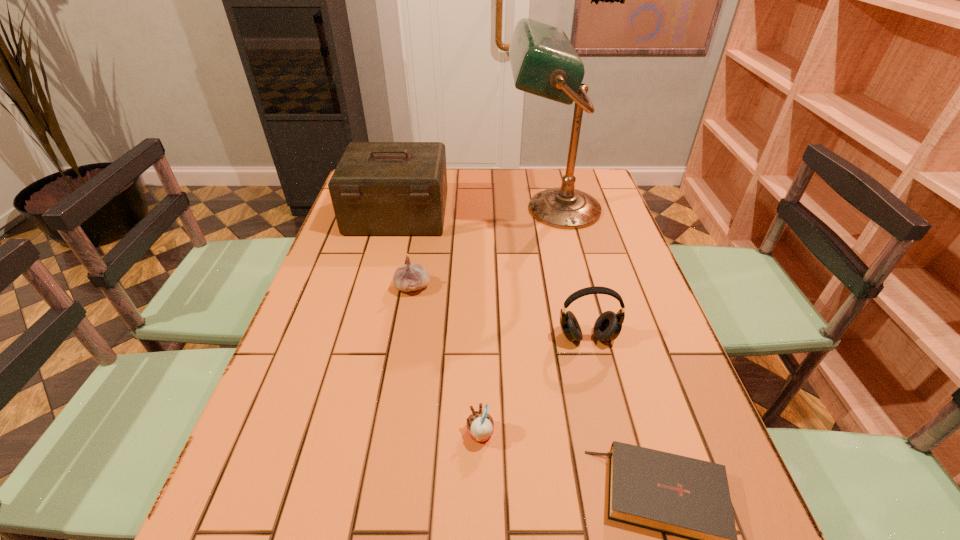
Identify the location of free location located above the green lampshade of the tallest object. (467, 209).

Locate an element on the screen. This screenshot has height=540, width=960. free spot located 0.050m on the front of the fifth shortest object is located at coordinates (389, 250).

This screenshot has width=960, height=540. Find the location of `blank space located on the ear cups of the third tallest object`. blank space located on the ear cups of the third tallest object is located at coordinates (612, 437).

I want to click on free space located on the front of the third shortest object, so pos(399,366).

You are a GUI agent. You are given a task and a screenshot of the screen. Output one action in this format:
    pyautogui.click(x=<x>, y=<y>)
    Task: Click on the vacant space positioned on the front-facing side of the third object from left to right
    The width and height of the screenshot is (960, 540).
    Given the screenshot: What is the action you would take?
    pyautogui.click(x=328, y=434)

Where is `vacant space situated 0.290m on the front-facing side of the third object from left to right`? vacant space situated 0.290m on the front-facing side of the third object from left to right is located at coordinates (318, 434).

You are a GUI agent. You are given a task and a screenshot of the screen. Output one action in this format:
    pyautogui.click(x=<x>, y=<y>)
    Task: Click on the vacant area situated on the front-facing side of the third object from left to right
    This screenshot has height=540, width=960.
    Given the screenshot: What is the action you would take?
    pyautogui.click(x=405, y=434)

Image resolution: width=960 pixels, height=540 pixels. I want to click on table lamp located in the far edge section of the desktop, so click(544, 62).

You are a GUI agent. You are given a task and a screenshot of the screen. Output one action in this format:
    pyautogui.click(x=<x>, y=<y>)
    Task: Click on the first-aid kit located in the far edge section of the desktop
    Image resolution: width=960 pixels, height=540 pixels.
    Given the screenshot: What is the action you would take?
    pyautogui.click(x=378, y=188)

Identify the location of object present at the left edge. (378, 188).